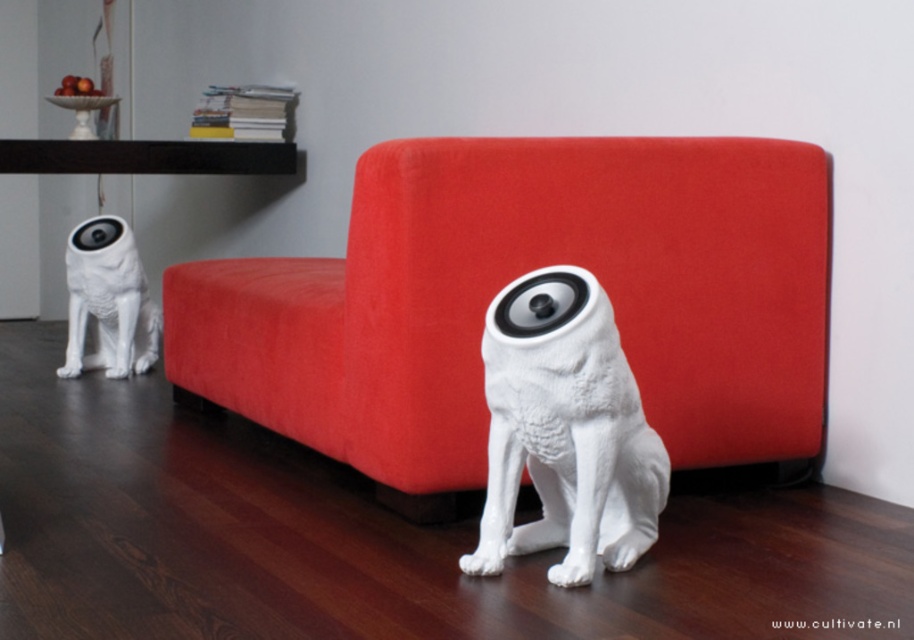
Question: Which point is farther from the camera taking this photo?

Choices:
 (A) (750, 320)
 (B) (548, 436)
 (C) (92, 268)

Answer: (C)

Question: Which object is farther from the camera taking this photo?

Choices:
 (A) white matte dog at lower left
 (B) red velvet couch at center

Answer: (A)

Question: Can you confirm if red velvet couch at center is positioned to the right of white matte speaker dog at left?

Choices:
 (A) yes
 (B) no

Answer: (B)

Question: Can you confirm if white matte speaker dog at left is positioned to the right of white matte dog at lower left?

Choices:
 (A) no
 (B) yes

Answer: (B)

Question: Which point appears closest to the camera in this image?

Choices:
 (A) (71, 260)
 (B) (650, 467)

Answer: (B)

Question: Is red velvet couch at center above white matte dog at lower left?

Choices:
 (A) no
 (B) yes

Answer: (A)